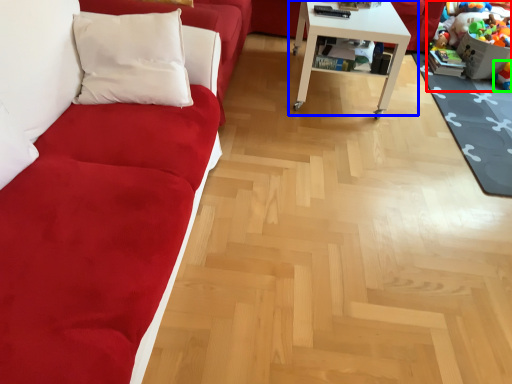
Question: Which object is positioned farthest from toy (highlighted by a red box)? Select from table (highlighted by a blue box) and toy (highlighted by a green box).

Choices:
 (A) table
 (B) toy

Answer: (A)